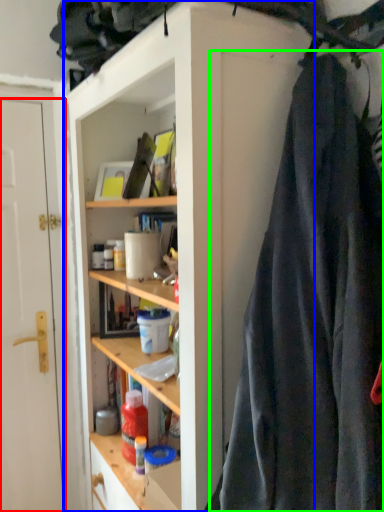
Question: Which object is the farthest from door (highlighted by a red box)? Choose among these: cabinetry (highlighted by a blue box) or clothing (highlighted by a green box).

Choices:
 (A) cabinetry
 (B) clothing

Answer: (B)